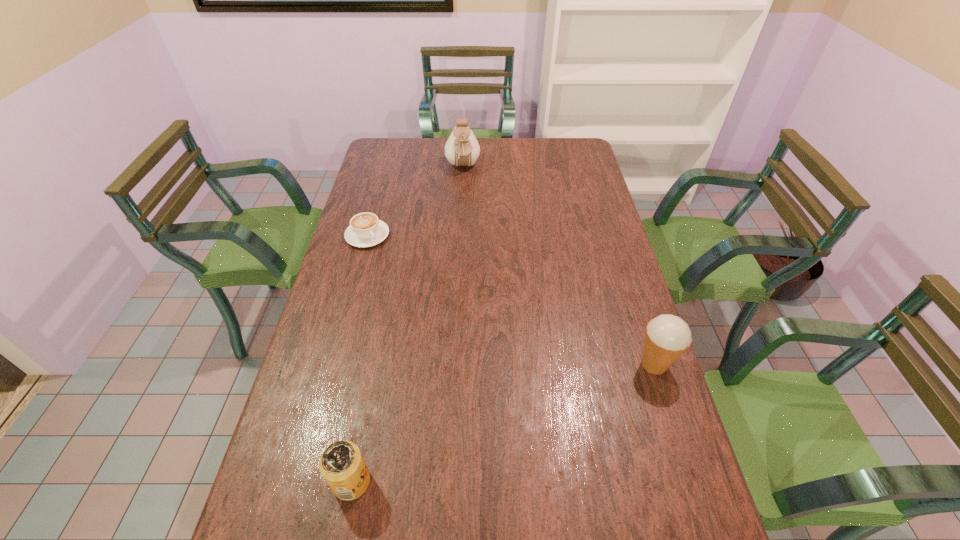
The height and width of the screenshot is (540, 960). I want to click on object at the right edge, so click(667, 337).

Locate an element on the screen. object that is positioned at the near left corner is located at coordinates (342, 465).

This screenshot has height=540, width=960. What are the coordinates of `vacant space at the far edge` in the screenshot? It's located at (438, 164).

In the image, there is a desktop. Identify the location of free space at the near edge. This screenshot has width=960, height=540. coord(611,495).

Where is `vacant space at the left edge of the desktop`? This screenshot has height=540, width=960. vacant space at the left edge of the desktop is located at coordinates (328, 339).

In the image, there is a desktop. Where is `free space at the right edge`? The width and height of the screenshot is (960, 540). free space at the right edge is located at coordinates (591, 356).

Locate an element on the screen. The height and width of the screenshot is (540, 960). free region at the far left corner is located at coordinates (397, 158).

Find the location of `vacant space that's between the nearest object and the pouch`. vacant space that's between the nearest object and the pouch is located at coordinates (407, 325).

Where is `empty location between the second shortest object and the cappuccino`? The width and height of the screenshot is (960, 540). empty location between the second shortest object and the cappuccino is located at coordinates (360, 359).

Image resolution: width=960 pixels, height=540 pixels. I want to click on free space between the icecream and the beer can, so click(x=503, y=423).